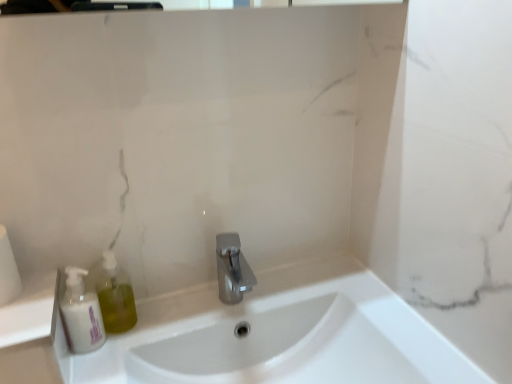
I want to click on blank space to the left of polished metallic faucet at center, so click(166, 316).